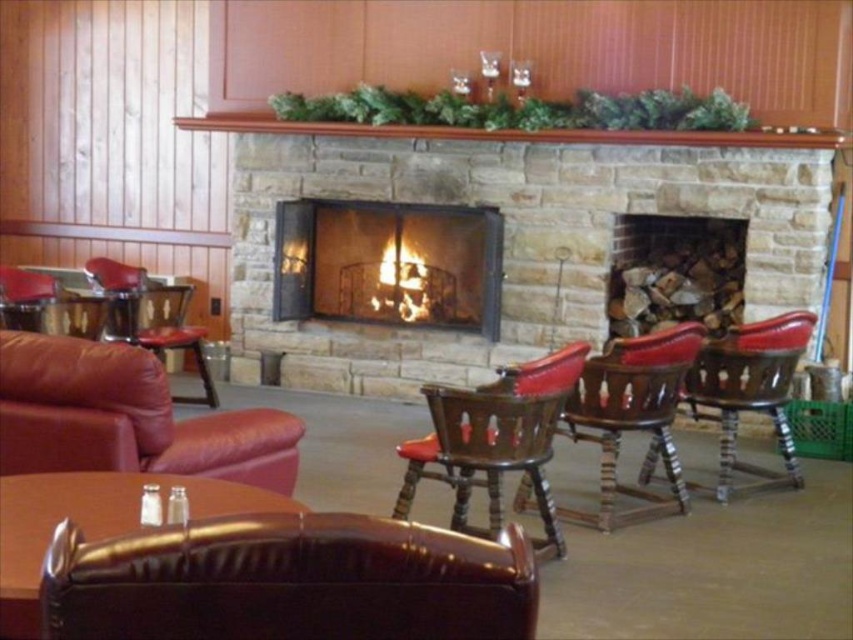
You are planning to place a rectangular coffee table that is 1.2 meters wide between the brown leather swivel chair at center and the shiny brown leather table at lower left. Based on their widths, will there be enough space for the coffee table?

The brown leather swivel chair at center has a lesser width compared to shiny brown leather table at lower left. Since the coffee table is 1.2 meters wide, and the chair is narrower than the table, there should be sufficient space between them to accommodate the coffee table.